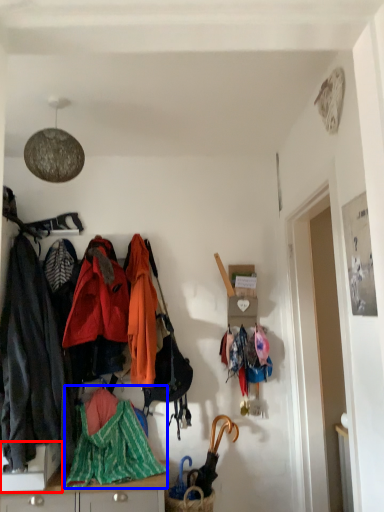
Question: Which of the following is the closest to the observer, desk (highlighted by a red box) or blanket (highlighted by a blue box)?

Choices:
 (A) desk
 (B) blanket

Answer: (A)